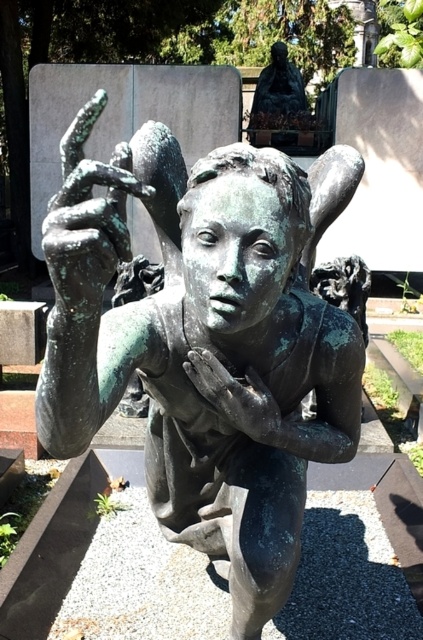
Question: Considering the real-world distances, which object is farthest from the bronze statue at upper center?

Choices:
 (A) green patina hand at center
 (B) green patina bronze statue at center

Answer: (A)

Question: In this image, where is green patina bronze statue at center located relative to bronze statue at upper center?

Choices:
 (A) above
 (B) below

Answer: (B)

Question: Among these points, which one is farthest from the camera?

Choices:
 (A) (271, 99)
 (B) (260, 380)
 (C) (279, 173)

Answer: (A)

Question: Is green patina hand at center to the right of bronze statue at upper center from the viewer's perspective?

Choices:
 (A) yes
 (B) no

Answer: (B)

Question: Which object is closer to the camera taking this photo?

Choices:
 (A) green patina hand at center
 (B) bronze statue at upper center
 (C) green patina bronze statue at center

Answer: (C)

Question: Can you confirm if green patina hand at center is positioned above bronze statue at upper center?

Choices:
 (A) no
 (B) yes

Answer: (A)